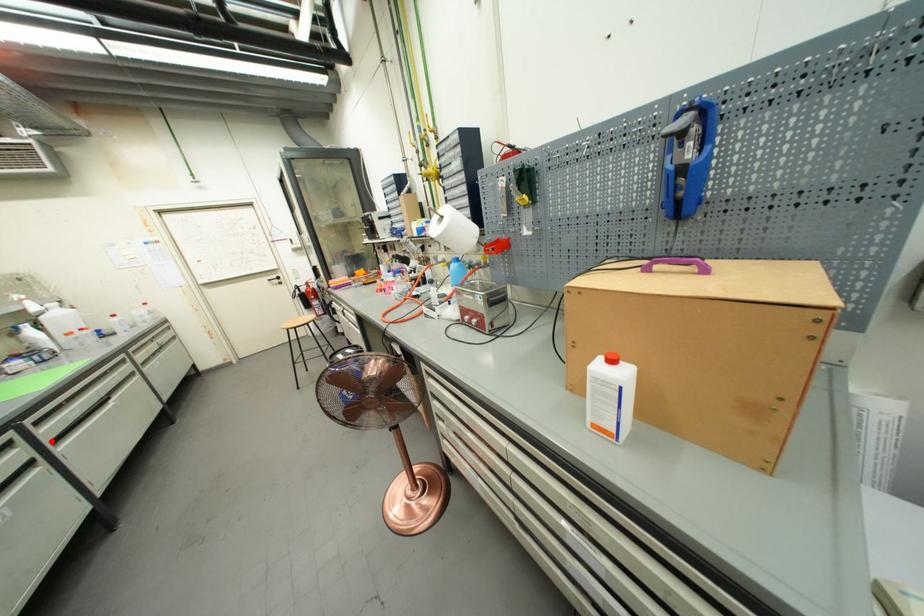
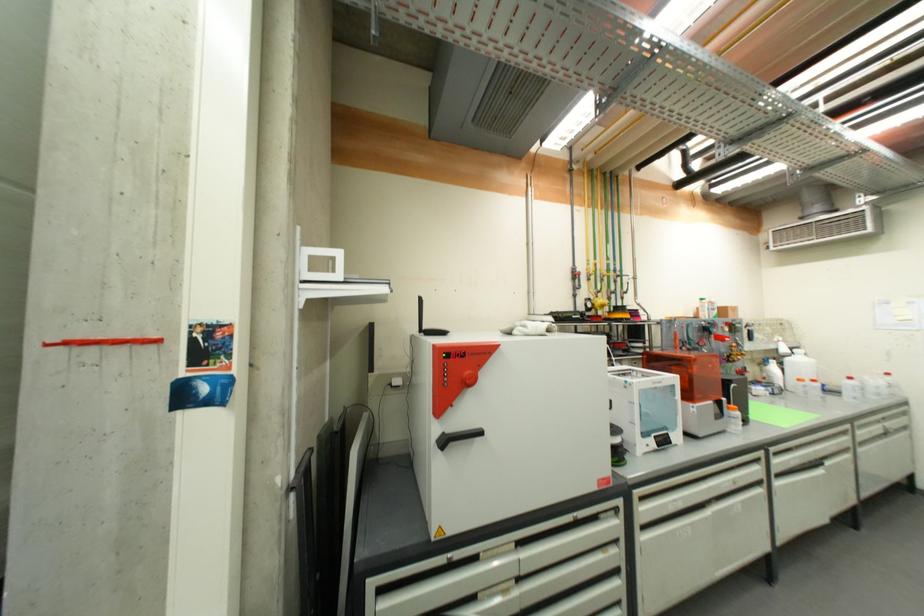
In the second image, find the point that corresponds to the highlighted location in the first image.

(779, 472)